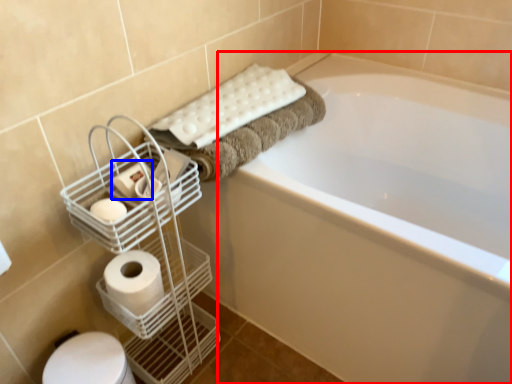
Question: Among these objects, which one is farthest to the camera, bathtub (highlighted by a red box) or toilet paper (highlighted by a blue box)?

Choices:
 (A) bathtub
 (B) toilet paper

Answer: (B)